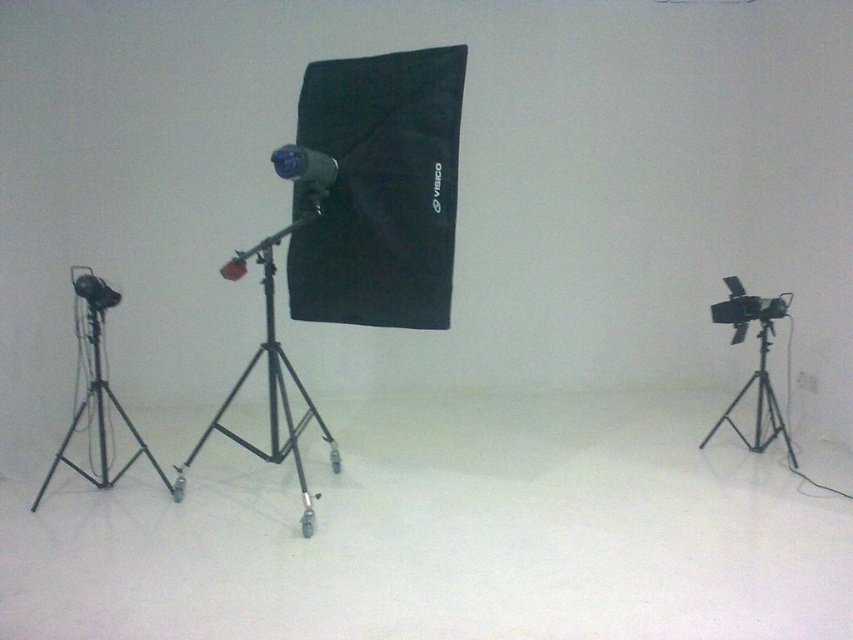
You are standing in the studio and want to move closer to the matte black tripod at right. If you take a step forward, will you be within 3 meters of it?

The matte black tripod at right is currently 3.83 meters away from you. Taking a step forward would reduce the distance, but unless you move at least 0.83 meters closer, you won

What is the purpose of the point marked at coordinates (268, 385) in the studio setup?

The point marked at coordinates (268, 385) indicates the location of the black matte tripod at center, which supports the larger lighting setup with the softbox diffuser and boom arm.

Looking at this image, you are setting up a photography studio and need to place a new equipment case between the black matte tripod at center and the matte black camera at center. Which side of the camera should you place it to maintain the existing arrangement?

The black matte tripod at center is positioned on the left side of the matte black camera at center, so to maintain the existing arrangement, place the equipment case to the left of the matte black camera at center.